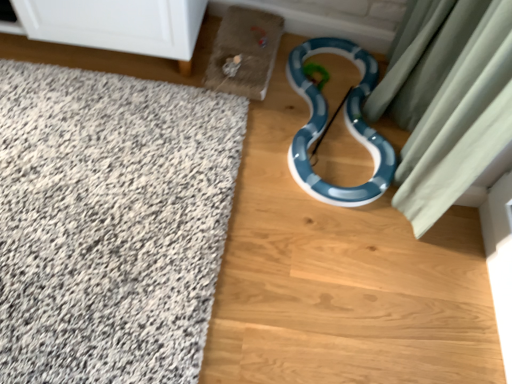
Question: Is white glossy cabinet at upper left thinner than white shaggy bath mat at left?

Choices:
 (A) no
 (B) yes

Answer: (B)

Question: Is white glossy cabinet at upper left closer to camera compared to white shaggy bath mat at left?

Choices:
 (A) no
 (B) yes

Answer: (A)

Question: Considering the relative positions of white glossy cabinet at upper left and white shaggy bath mat at left in the image provided, is white glossy cabinet at upper left to the right of white shaggy bath mat at left from the viewer's perspective?

Choices:
 (A) yes
 (B) no

Answer: (B)

Question: Is white glossy cabinet at upper left not inside white shaggy bath mat at left?

Choices:
 (A) yes
 (B) no

Answer: (A)

Question: Does white glossy cabinet at upper left have a smaller size compared to white shaggy bath mat at left?

Choices:
 (A) no
 (B) yes

Answer: (A)

Question: From a real-world perspective, is white glossy cabinet at upper left beneath white shaggy bath mat at left?

Choices:
 (A) yes
 (B) no

Answer: (B)

Question: Does blue glossy dirt track at center-right have a lesser height compared to blue glossy snake at center?

Choices:
 (A) no
 (B) yes

Answer: (A)

Question: Is blue glossy dirt track at center-right facing away from blue glossy snake at center?

Choices:
 (A) no
 (B) yes

Answer: (A)

Question: Is blue glossy dirt track at center-right taller than blue glossy snake at center?

Choices:
 (A) yes
 (B) no

Answer: (A)

Question: From a real-world perspective, does blue glossy dirt track at center-right stand above blue glossy snake at center?

Choices:
 (A) yes
 (B) no

Answer: (B)

Question: Does blue glossy dirt track at center-right contain blue glossy snake at center?

Choices:
 (A) no
 (B) yes

Answer: (B)

Question: Is the position of blue glossy dirt track at center-right more distant than that of blue glossy snake at center?

Choices:
 (A) yes
 (B) no

Answer: (B)

Question: Can you confirm if white shaggy bath mat at left is shorter than blue glossy snake at center?

Choices:
 (A) no
 (B) yes

Answer: (A)